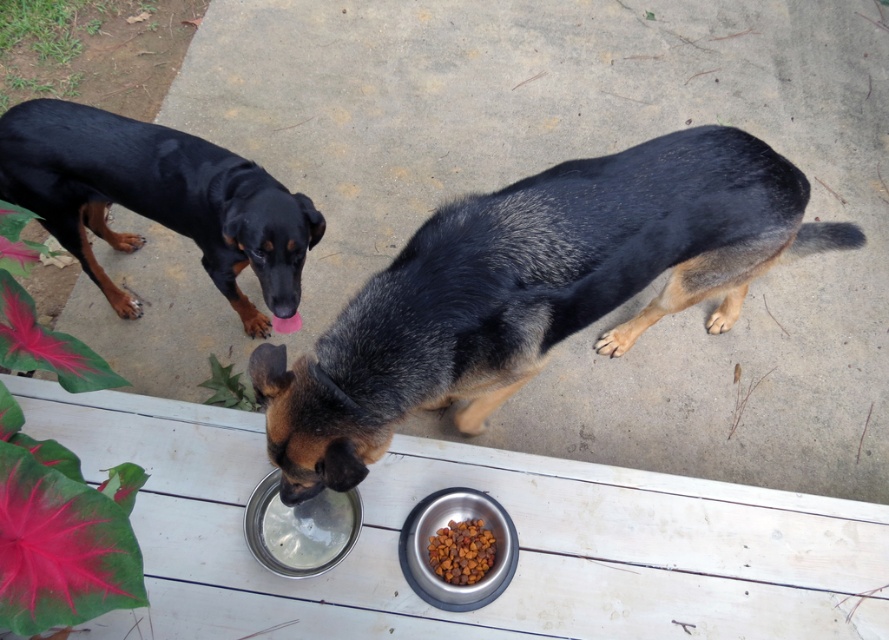
Question: Is metallic silver bowl at lower center further to camera compared to dry kibble at lower center?

Choices:
 (A) no
 (B) yes

Answer: (A)

Question: In this image, where is black fur dog at center located relative to black glossy fur at upper left?

Choices:
 (A) below
 (B) above

Answer: (A)

Question: Which object is farther from the camera taking this photo?

Choices:
 (A) black fur dog at center
 (B) dry kibble at lower center

Answer: (B)

Question: Which point is farther to the camera?

Choices:
 (A) (434, 563)
 (B) (451, 384)
 (C) (410, 557)
 (D) (76, 218)

Answer: (D)

Question: Is black fur dog at center below metallic silver bowl at lower center?

Choices:
 (A) yes
 (B) no

Answer: (B)

Question: Based on their relative distances, which object is farther from the black fur dog at center?

Choices:
 (A) black glossy fur at upper left
 (B) metallic silver bowl at lower center
 (C) dry kibble at lower center

Answer: (A)